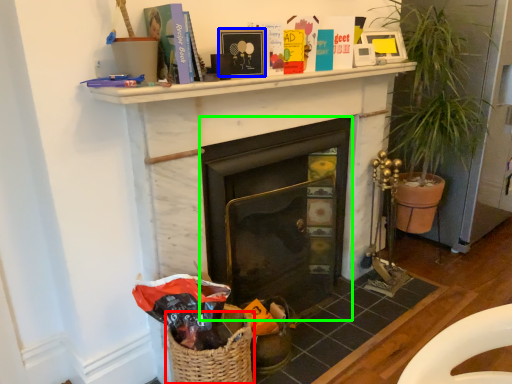
Question: Which is farther away from basket (highlighted by a red box)? picture frame (highlighted by a blue box) or fireplace (highlighted by a green box)?

Choices:
 (A) picture frame
 (B) fireplace

Answer: (A)